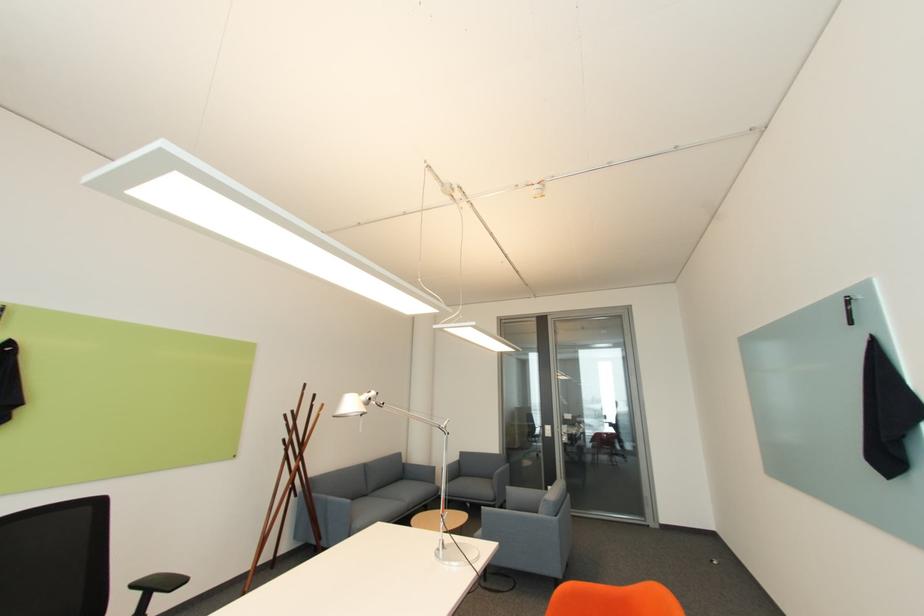
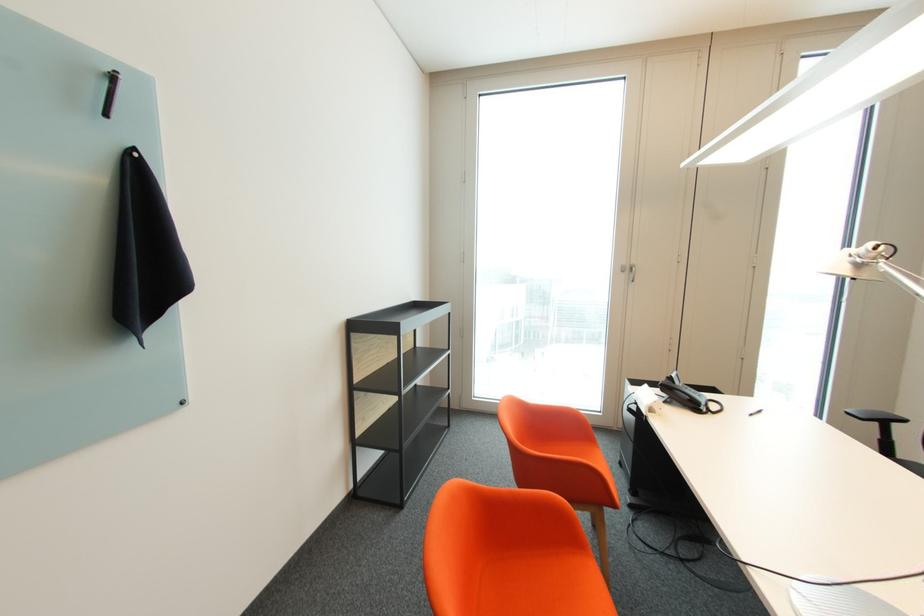
Locate, in the second image, the point that corresponds to [377,399] in the first image.

(860, 256)